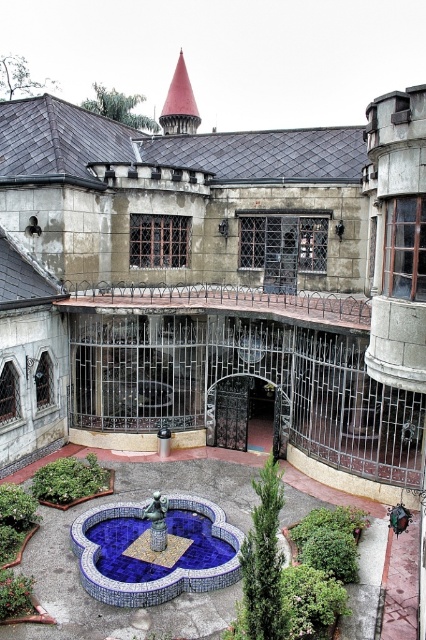
Question: Can you confirm if stone castle at center is positioned above green leafy bush at center?

Choices:
 (A) no
 (B) yes

Answer: (B)

Question: Considering the real-world distances, which object is farthest from the green leafy bush at center?

Choices:
 (A) stone castle at center
 (B) blue mosaic fountain at center

Answer: (A)

Question: Among these objects, which one is nearest to the camera?

Choices:
 (A) stone castle at center
 (B) green leafy bush at center

Answer: (A)

Question: Does blue mosaic fountain at center have a larger size compared to green leafy bush at center?

Choices:
 (A) no
 (B) yes

Answer: (B)

Question: Based on their relative distances, which object is farther from the green leafy bush at center?

Choices:
 (A) stone castle at center
 (B) blue mosaic fountain at center

Answer: (A)

Question: Does blue mosaic fountain at center appear over green leafy bush at center?

Choices:
 (A) no
 (B) yes

Answer: (A)